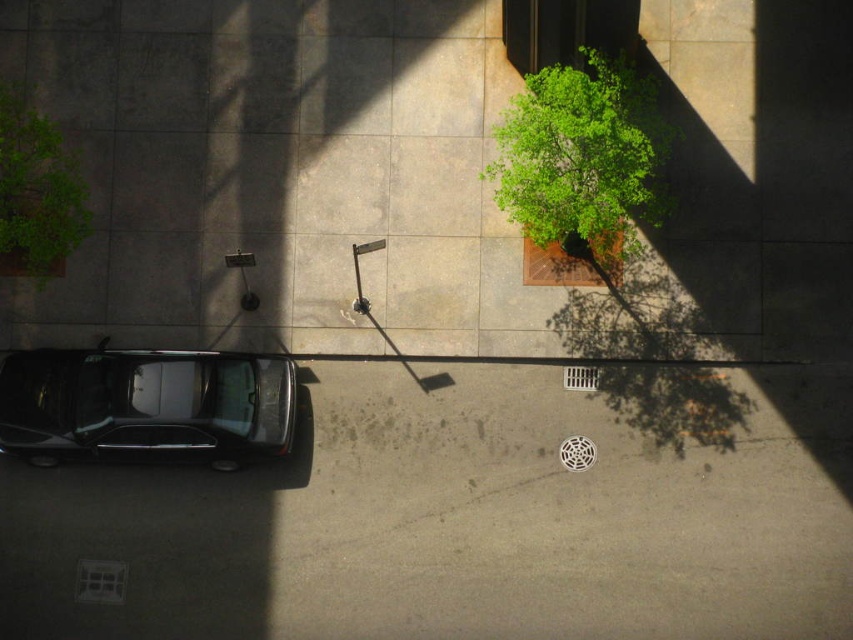
Does shiny black car at lower left have a lesser width compared to green leafy plant at upper left?

No.

Between point (268, 401) and point (13, 204), which one is positioned in front?

Positioned in front is point (13, 204).

Where is `shiny black car at lower left`? Image resolution: width=853 pixels, height=640 pixels. shiny black car at lower left is located at coordinates (144, 404).

This screenshot has width=853, height=640. In order to click on shiny black car at lower left in this screenshot , I will do `click(144, 404)`.

Does green leafy tree at upper center appear on the left side of green leafy plant at upper left?

In fact, green leafy tree at upper center is to the right of green leafy plant at upper left.

Does green leafy tree at upper center have a larger size compared to green leafy plant at upper left?

Yes.

Does point (653, 196) lie in front of point (80, 221)?

Yes.

This screenshot has height=640, width=853. I want to click on green leafy tree at upper center, so click(x=581, y=157).

Between shiny black car at lower left and green leafy tree at upper center, which one has less height?

shiny black car at lower left is shorter.

Which is below, shiny black car at lower left or green leafy tree at upper center?

shiny black car at lower left is lower down.

Measure the distance between shiny black car at lower left and camera.

shiny black car at lower left is 41.56 feet away from camera.

Where is `shiny black car at lower left`? This screenshot has height=640, width=853. shiny black car at lower left is located at coordinates (144, 404).